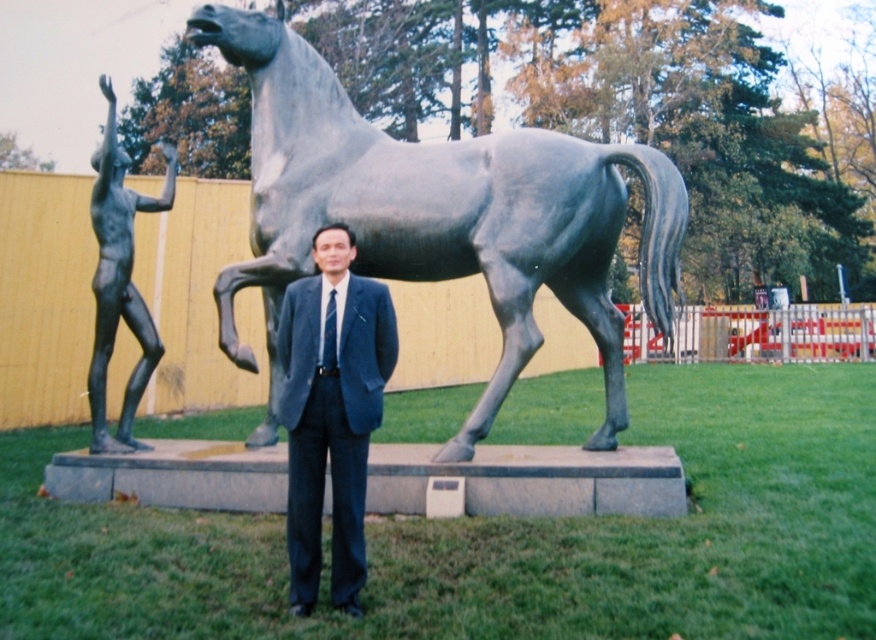
What are the coordinates of the blue fabric suit at center?

The coordinates of the blue fabric suit at center are at point (331, 412).

You are standing at the center of the grassy area and want to walk directly to the bronze horse at center. Which direction should you head towards?

Since you are already at the center of the grassy area and the bronze horse at center is located at point [436,216], you should head towards the bronze horse at center directly as it is positioned at the central area.

You are an art student standing in front of the two sculptures. You want to take a photo that captures both the bronze horse at center and the black matte figure at left in the same frame. Based on their positions, which sculpture should you position closer to the left side of your camera frame?

You should position the black matte figure at left closer to the left side of your camera frame since it is already located to the left of the bronze horse at center.